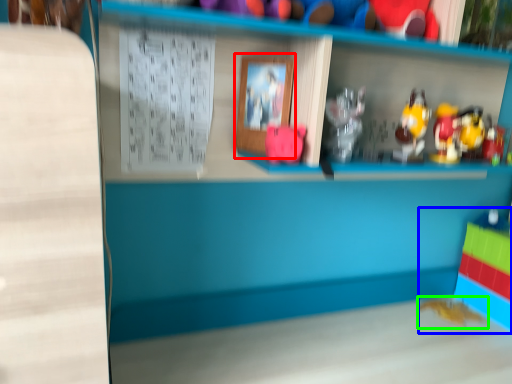
Question: Which object is the closest to the picture frame (highlighted by a red box)? Choose among these: toy (highlighted by a blue box) or toy (highlighted by a green box).

Choices:
 (A) toy
 (B) toy

Answer: (B)